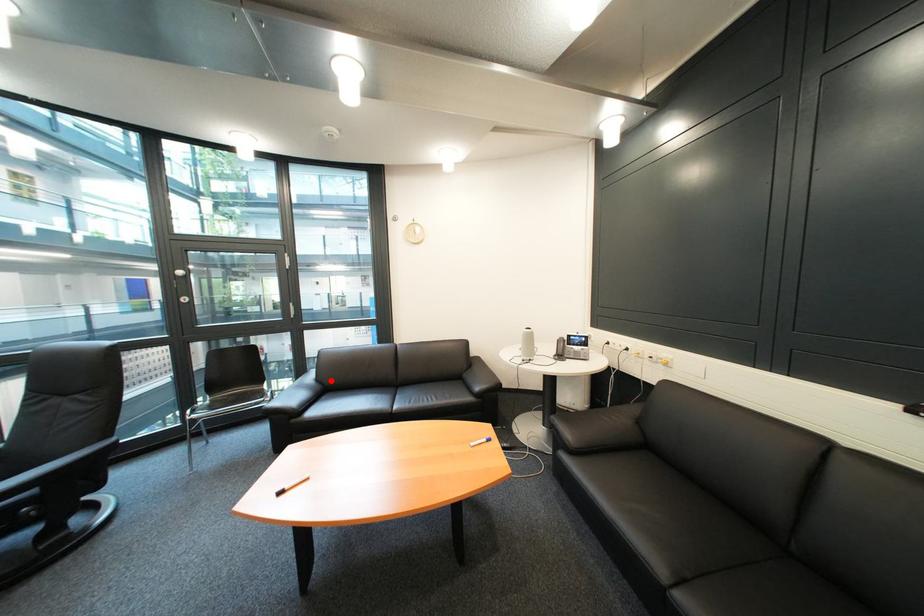
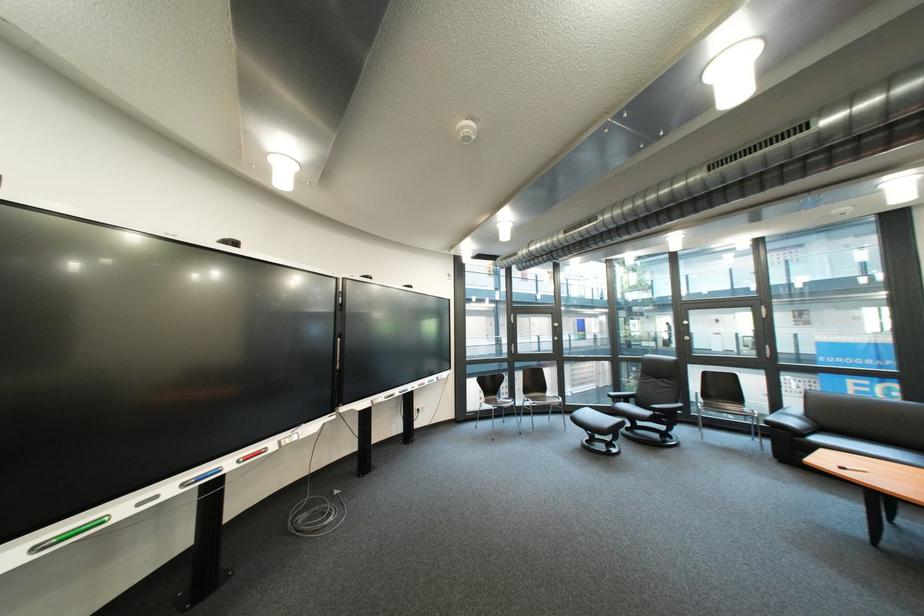
In the second image, find the point that corresponds to the highlighted location in the first image.

(822, 418)